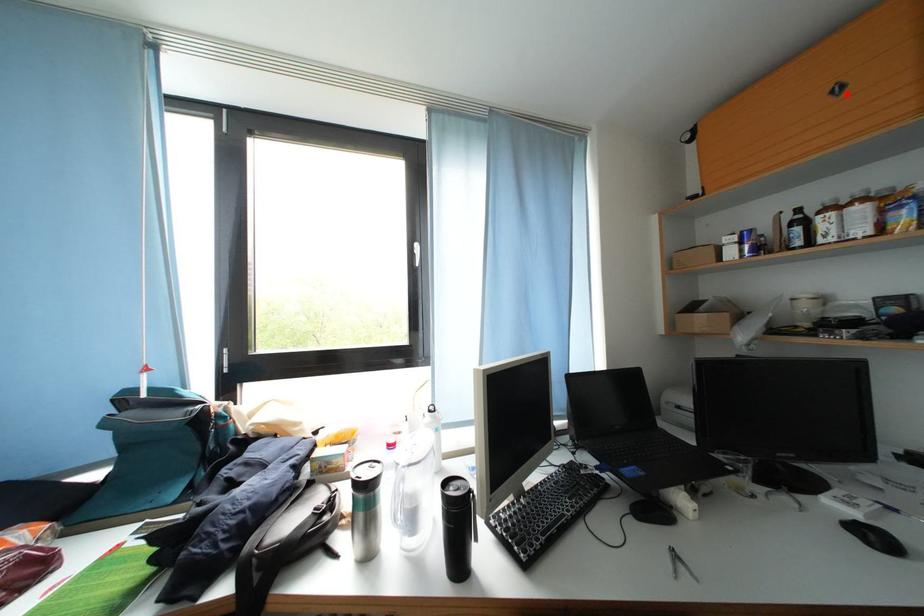
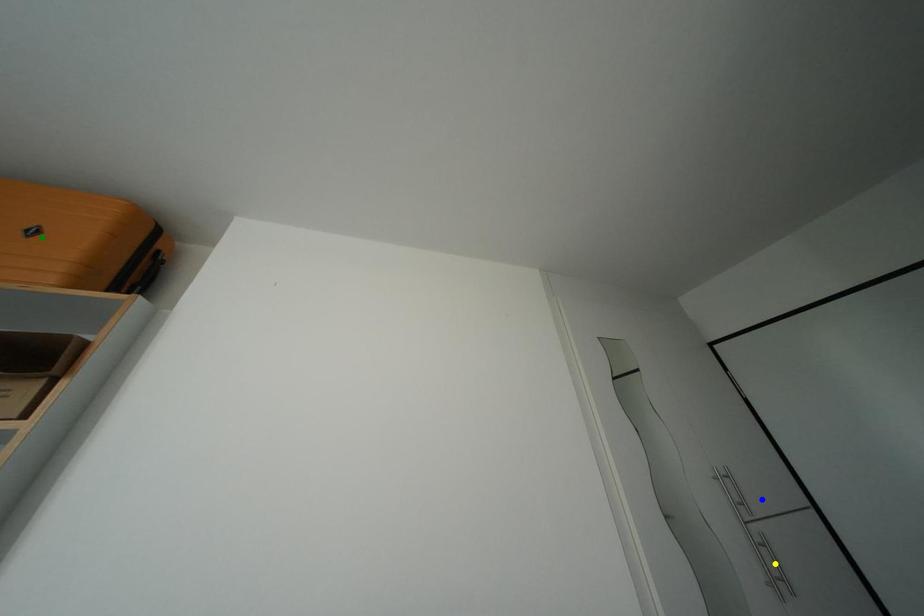
Question: I am providing you with two images of the same scene from different viewpoints. A red point is marked on the first image. You are given multiple points on the second image. Which spot in image 2 lines up with the point in image 1?

Choices:
 (A) yellow point
 (B) green point
 (C) blue point

Answer: (B)